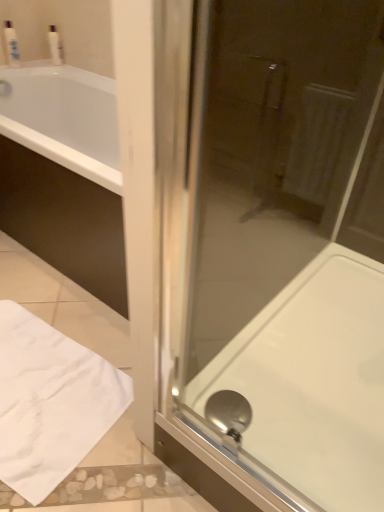
The width and height of the screenshot is (384, 512). I want to click on space that is in front of white glossy bottle at upper left, the first toiletry viewed from the right, so click(x=48, y=68).